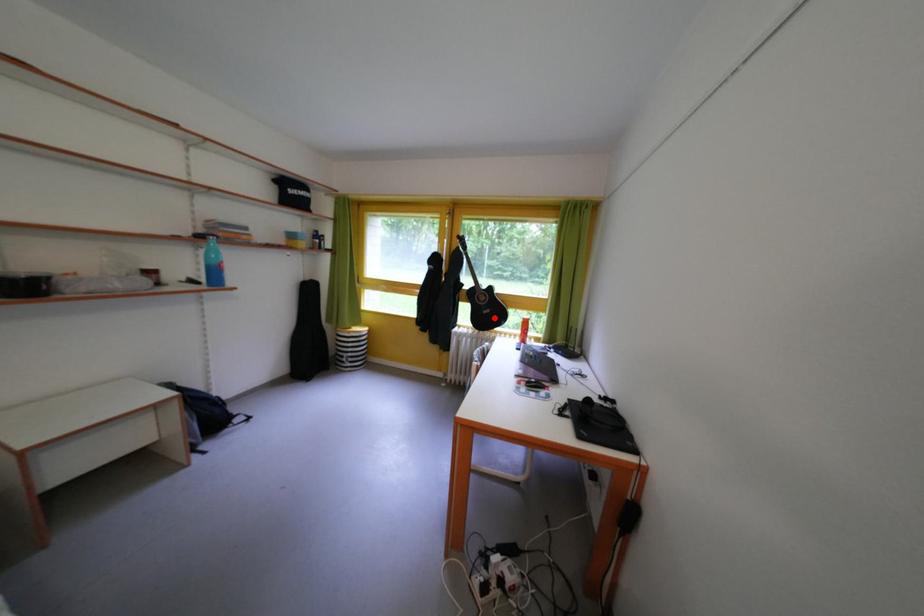
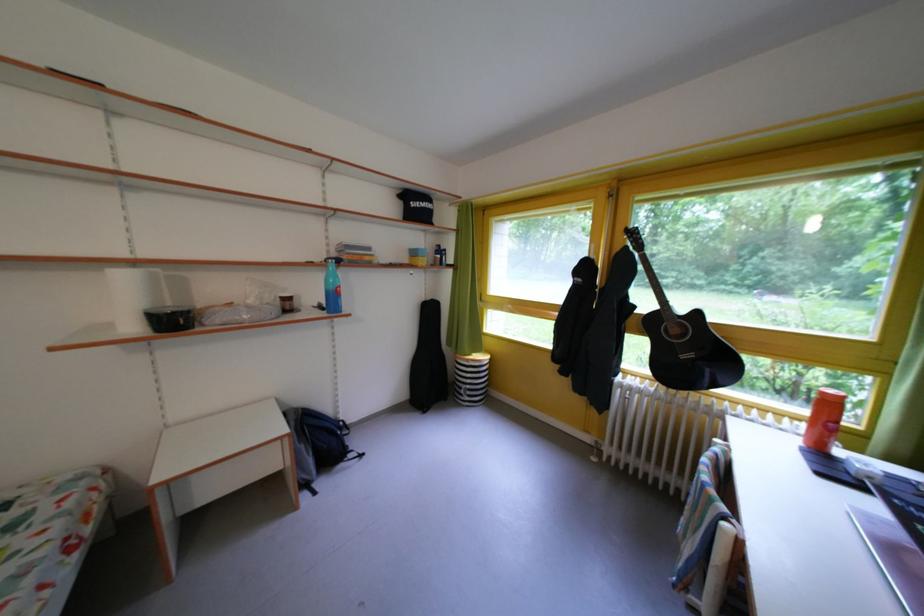
Find the pixel in the second image that matches the highlighted location in the first image.

(693, 362)